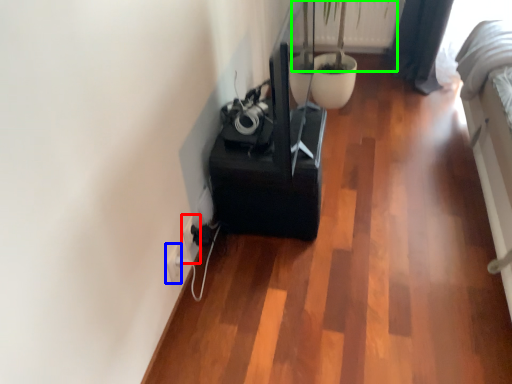
Question: Which object is positioned closest to electric outlet (highlighted by a red box)? Select from electric outlet (highlighted by a blue box) and plant (highlighted by a green box).

Choices:
 (A) electric outlet
 (B) plant

Answer: (A)